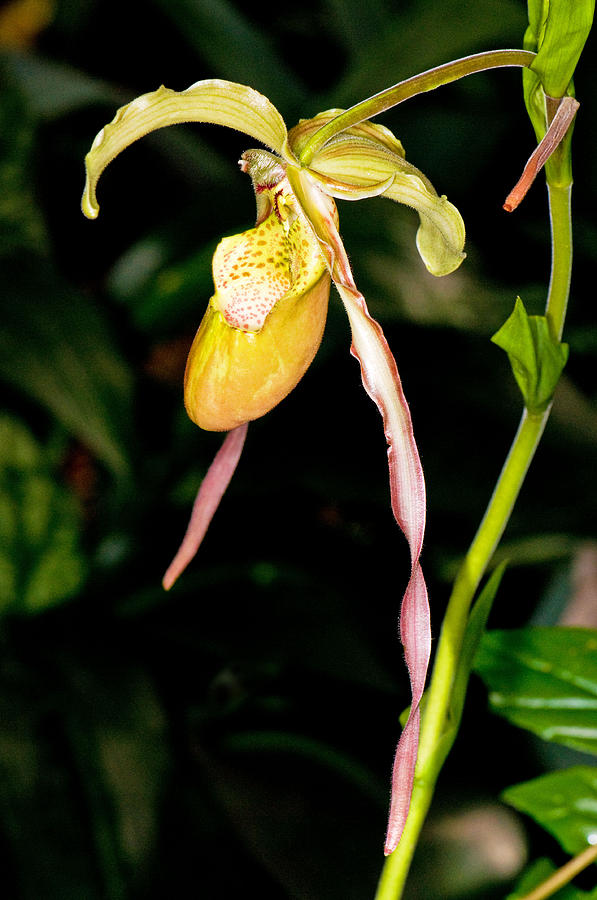
The width and height of the screenshot is (597, 900). Identify the location of bottom pedal. (294, 360).